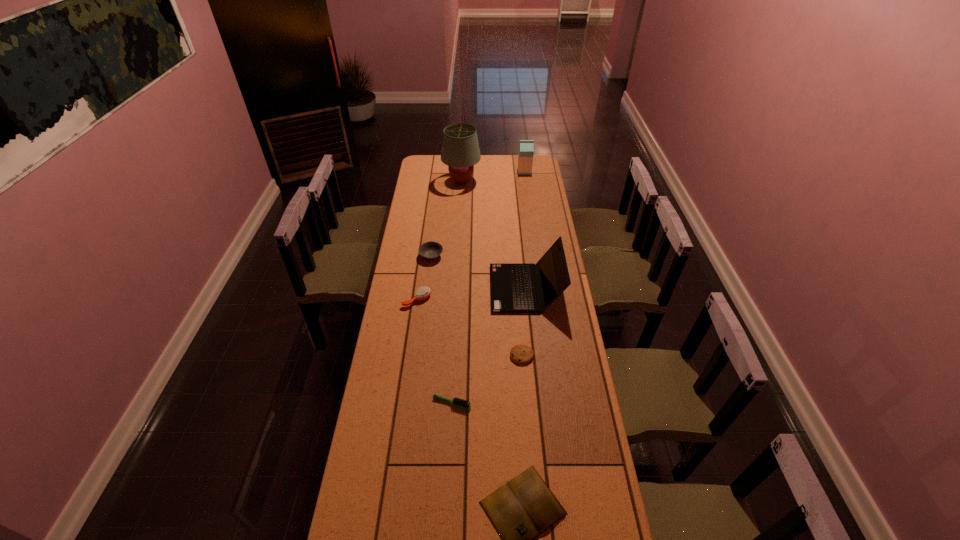
The width and height of the screenshot is (960, 540). What are the coordinates of `vacant area located 0.100m on the front of the milk carton` in the screenshot? It's located at (526, 184).

In order to click on vacant point located on the screen of the laptop computer in this screenshot , I will do `click(417, 288)`.

What are the coordinates of `vacant space located 0.360m on the screen of the laptop computer` in the screenshot? It's located at (413, 288).

This screenshot has width=960, height=540. What are the coordinates of `vacant space situated 0.060m on the screen of the laptop computer` in the screenshot? It's located at (477, 288).

Locate an element on the screen. vacant area situated 0.160m on the front of the bowl is located at coordinates (427, 287).

The height and width of the screenshot is (540, 960). I want to click on vacant region located 0.320m on the back of the taller hairbrush, so click(424, 246).

Locate an element on the screen. free space located 0.340m on the back of the right hairbrush is located at coordinates (456, 325).

The image size is (960, 540). Find the location of `free region located on the back of the third nearest object`. free region located on the back of the third nearest object is located at coordinates (516, 287).

You are a GUI agent. You are given a task and a screenshot of the screen. Output one action in this format:
    pyautogui.click(x=<x>, y=<y>)
    Task: Click on the lampshade that is positioned at the far edge
    Image resolution: width=960 pixels, height=540 pixels.
    Given the screenshot: What is the action you would take?
    pyautogui.click(x=460, y=151)

At what (x,y) coordinates should I click in order to perform the action: click on milk carton present at the far edge. Please return your answer as a coordinate pair (x, y). The image size is (960, 540). Looking at the image, I should click on (526, 147).